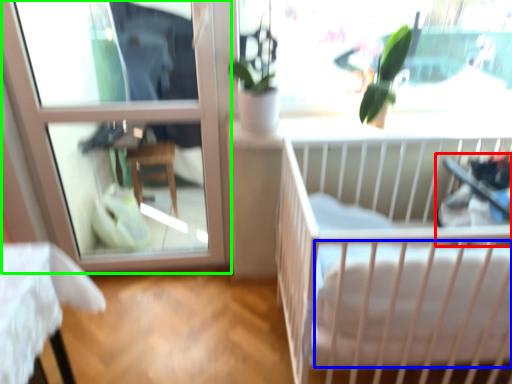
Question: Which object is positioned farthest from baby carriage (highlighted by a red box)? Select from mattress (highlighted by a blue box) and window (highlighted by a green box).

Choices:
 (A) mattress
 (B) window

Answer: (B)